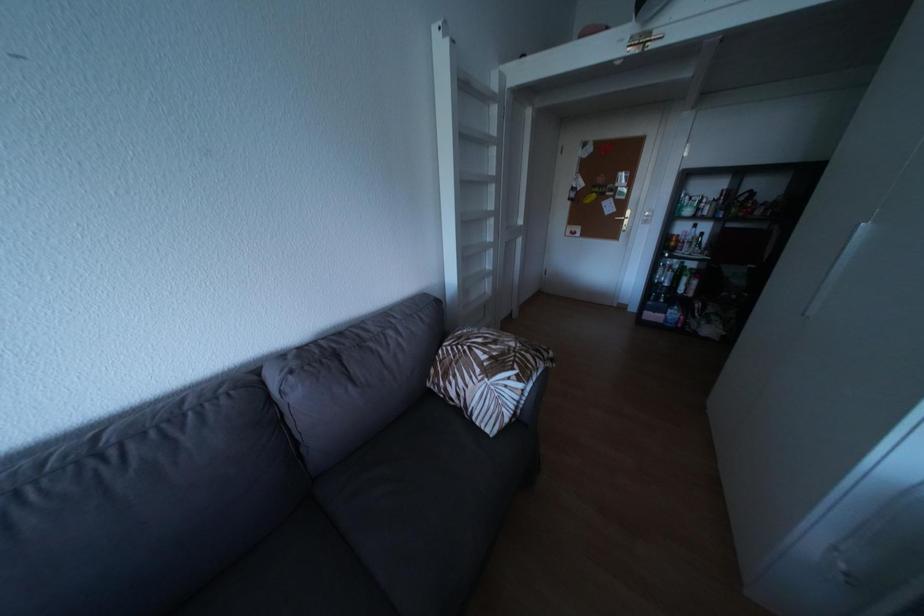
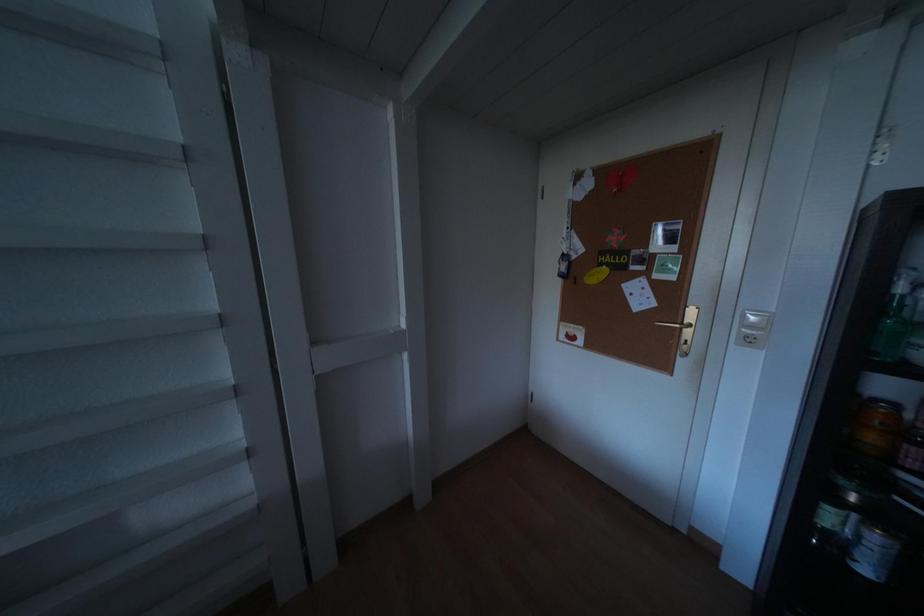
The images are taken continuously from a first-person perspective. In which direction are you moving?

The cameraman moved toward right, forward.